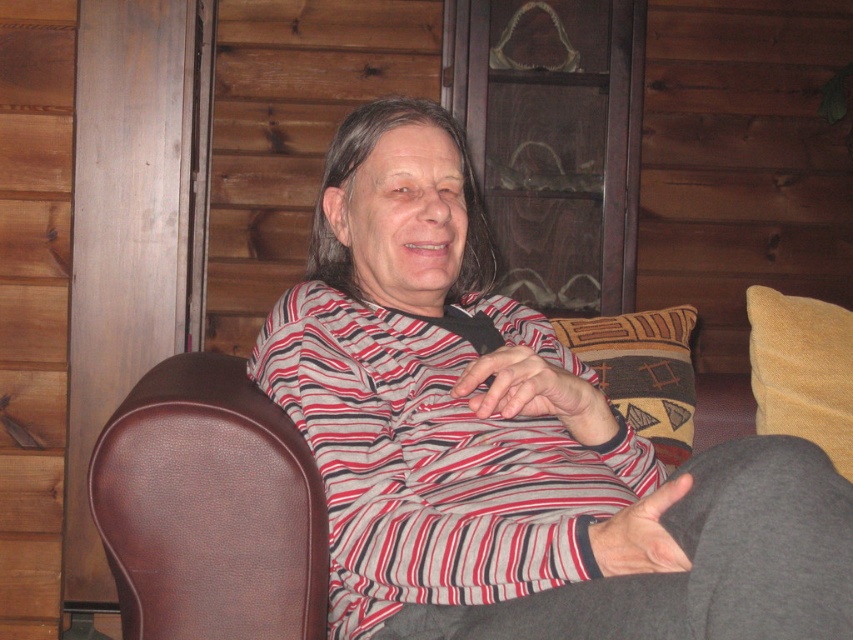
Can you confirm if striped fabric shirt at center is taller than yellow soft cushion at right?

Correct, striped fabric shirt at center is much taller as yellow soft cushion at right.

Between striped fabric shirt at center and yellow soft cushion at right, which one is positioned lower?

yellow soft cushion at right is lower down.

Identify the location of striped fabric shirt at center. (512, 440).

Find the location of `yellow soft cushion at right`. yellow soft cushion at right is located at coordinates (802, 371).

What do you see at coordinates (802, 371) in the screenshot?
I see `yellow soft cushion at right` at bounding box center [802, 371].

Find the location of a particular element. The image size is (853, 640). yellow soft cushion at right is located at coordinates (802, 371).

Identify the location of yellow soft cushion at right. (802, 371).

Does striped fabric shirt at center have a larger size compared to patterned fabric pillow at center?

Yes.

Between point (355, 394) and point (648, 323), which one is positioned in front?

Point (355, 394)

What do you see at coordinates (512, 440) in the screenshot? This screenshot has height=640, width=853. I see `striped fabric shirt at center` at bounding box center [512, 440].

What are the coordinates of `striped fabric shirt at center` in the screenshot? It's located at (512, 440).